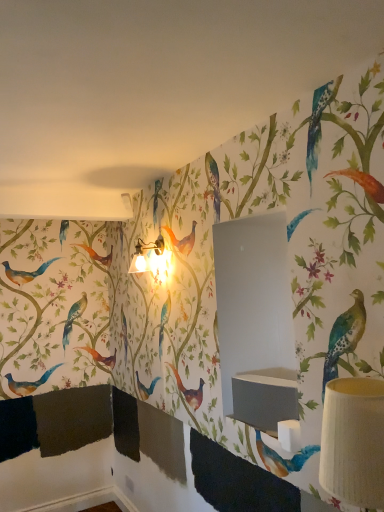
Question: From a real-world perspective, is metallic gold table lamp at upper center, which appears as the second table lamp when ordered from the bottom, physically above matte gray sink at center?

Choices:
 (A) yes
 (B) no

Answer: (A)

Question: Is metallic gold table lamp at upper center, the 2th table lamp in the front-to-back sequence, facing away from matte gray sink at center?

Choices:
 (A) no
 (B) yes

Answer: (A)

Question: Is metallic gold table lamp at upper center, which is the 1th table lamp in top-to-bottom order, at the left side of matte gray sink at center?

Choices:
 (A) yes
 (B) no

Answer: (A)

Question: From the image's perspective, is metallic gold table lamp at upper center, the 2th table lamp in the front-to-back sequence, over matte gray sink at center?

Choices:
 (A) no
 (B) yes

Answer: (B)

Question: From the image's perspective, would you say metallic gold table lamp at upper center, which is the first table lamp in left-to-right order, is shown under matte gray sink at center?

Choices:
 (A) yes
 (B) no

Answer: (B)

Question: Is matte gray sink at center completely or partially inside metallic gold table lamp at upper center, which appears as the second table lamp when ordered from the bottom?

Choices:
 (A) yes
 (B) no

Answer: (B)

Question: Is the position of metallic gold table lamp at upper center, which is the first table lamp in left-to-right order, more distant than that of white textured lampshade at right, which is the 2th table lamp from left to right?

Choices:
 (A) yes
 (B) no

Answer: (A)

Question: Is metallic gold table lamp at upper center, the 2th table lamp in the right-to-left sequence, thinner than white textured lampshade at right, acting as the 2th table lamp starting from the back?

Choices:
 (A) no
 (B) yes

Answer: (B)

Question: Is metallic gold table lamp at upper center, acting as the first table lamp starting from the back, positioned before white textured lampshade at right, the 1th table lamp when ordered from front to back?

Choices:
 (A) yes
 (B) no

Answer: (B)

Question: Is metallic gold table lamp at upper center, acting as the first table lamp starting from the back, facing towards white textured lampshade at right, the second table lamp in the top-to-bottom sequence?

Choices:
 (A) no
 (B) yes

Answer: (A)

Question: From a real-world perspective, is metallic gold table lamp at upper center, which is the first table lamp in left-to-right order, located beneath white textured lampshade at right, the second table lamp in the top-to-bottom sequence?

Choices:
 (A) no
 (B) yes

Answer: (A)

Question: Does metallic gold table lamp at upper center, the 2th table lamp in the right-to-left sequence, have a greater width compared to white textured lampshade at right, the 1th table lamp viewed from the right?

Choices:
 (A) no
 (B) yes

Answer: (A)

Question: Is matte gray sink at center positioned beyond the bounds of white textured lampshade at right, acting as the 2th table lamp starting from the back?

Choices:
 (A) no
 (B) yes

Answer: (B)